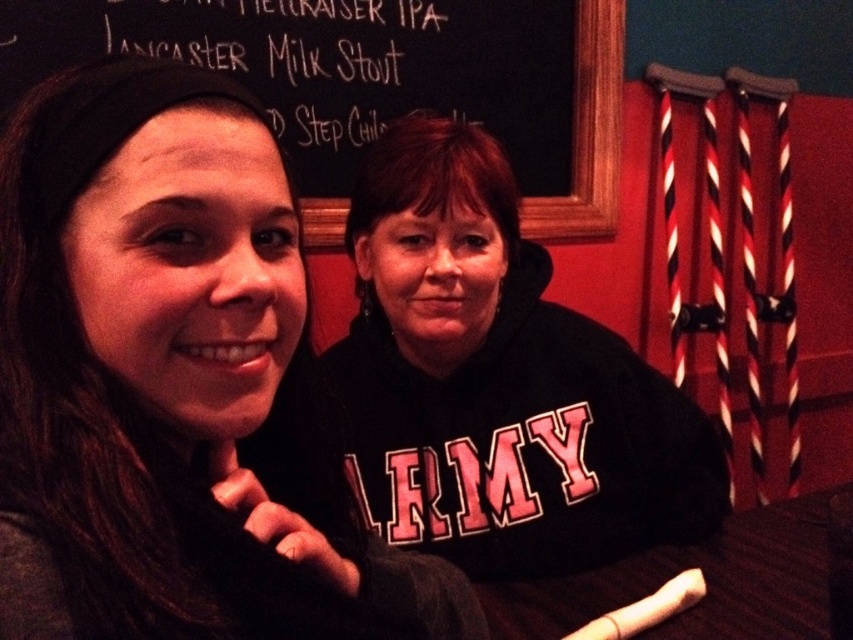
You are a photographer standing in front of the scene. You want to take a photo that focuses on the matte black hoodie at center without the black chalkboard at upper center being visible in the background. Is this possible based on their positions?

The matte black hoodie at center is closer to the viewer than the black chalkboard at upper center. Since the hoodie is in front, it can block the chalkboard from view if positioned correctly, making it possible to take a photo focusing on the hoodie without the chalkboard visible.